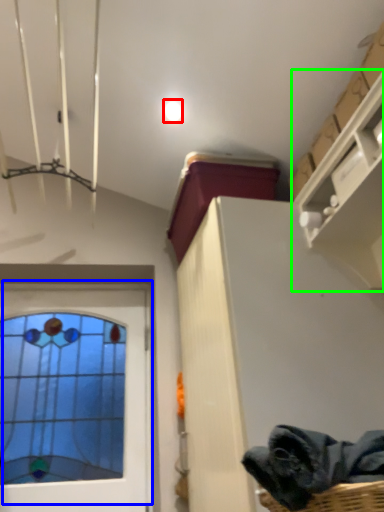
Question: Which is farther away from droplight (highlighted by a red box)? window (highlighted by a blue box) or shelf (highlighted by a green box)?

Choices:
 (A) window
 (B) shelf

Answer: (A)